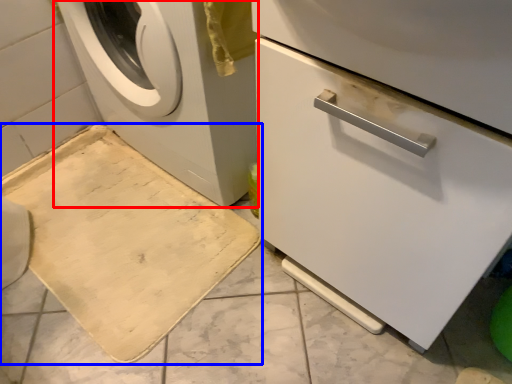
Question: Which point is further to the camera, washing machine (highlighted by a red box) or bath mat (highlighted by a blue box)?

Choices:
 (A) washing machine
 (B) bath mat

Answer: (B)